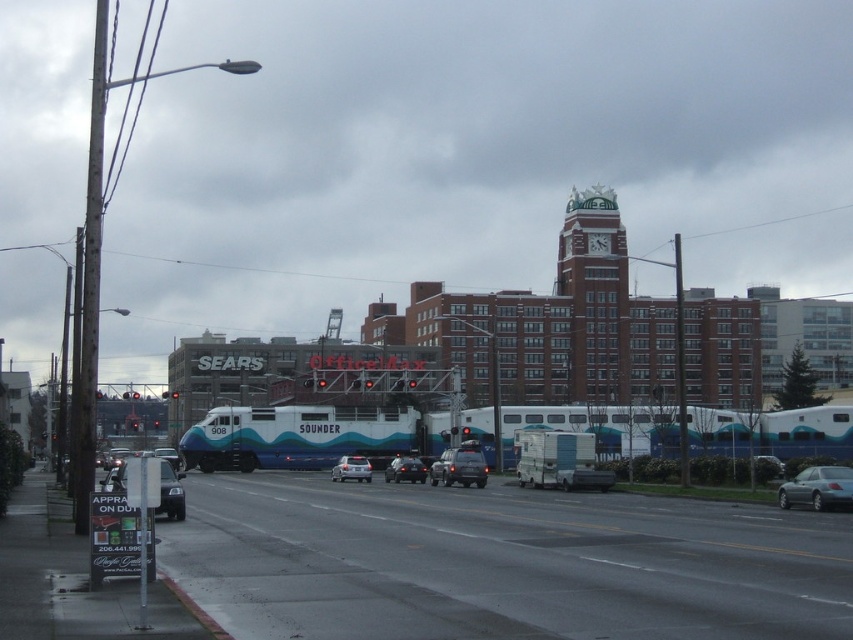
Question: Which is farther from the matte silver sedan at center?

Choices:
 (A) shiny black sedan at center
 (B) white brick clock tower at center
 (C) matte gray suv at center
 (D) silver metallic sedan at lower right

Answer: (B)

Question: Considering the real-world distances, which object is farthest from the shiny black sedan at center?

Choices:
 (A) silver metallic sedan at center
 (B) white brick clock tower at center
 (C) matte silver sedan at center
 (D) matte gray suv at center

Answer: (B)

Question: Can you confirm if matte silver sedan at center is wider than matte gray suv at center?

Choices:
 (A) yes
 (B) no

Answer: (A)

Question: Does silver metallic sedan at lower right appear under matte silver sedan at center?

Choices:
 (A) yes
 (B) no

Answer: (B)

Question: Can you confirm if shiny black sedan at center is thinner than silver metallic sedan at center?

Choices:
 (A) no
 (B) yes

Answer: (B)

Question: Estimate the real-world distances between objects in this image. Which object is farther from the silver metallic sedan at center?

Choices:
 (A) matte silver sedan at center
 (B) matte gray suv at center
 (C) white brick clock tower at center

Answer: (C)